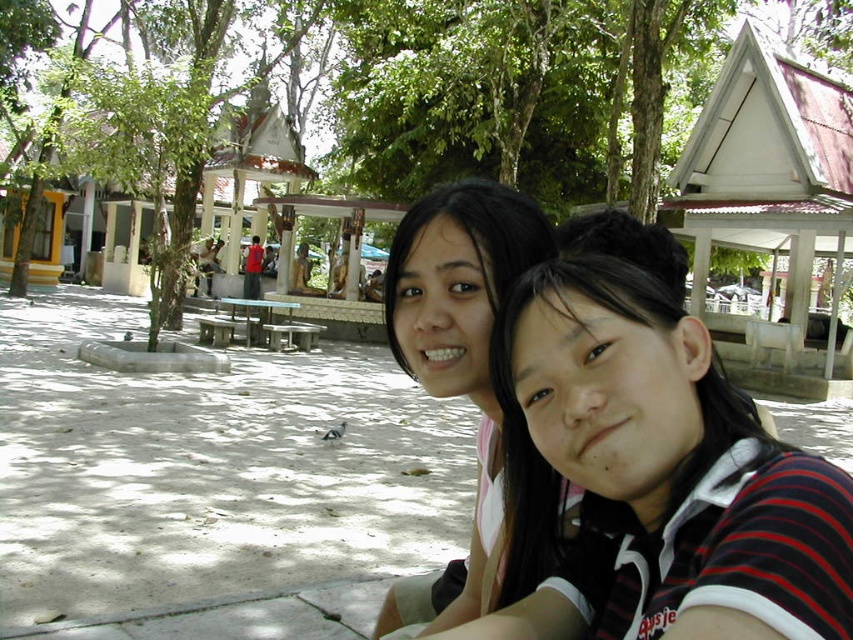
Is matte black shirt at center shorter than green leafy tree at center?

Yes.

Does matte black shirt at center have a greater height compared to green leafy tree at center?

Incorrect, matte black shirt at center's height is not larger of green leafy tree at center's.

Between point (602, 468) and point (364, 124), which one is positioned in front?

Point (602, 468) is more forward.

You are a GUI agent. You are given a task and a screenshot of the screen. Output one action in this format:
    pyautogui.click(x=<x>, y=<y>)
    Task: Click on the matte black shirt at center
    
    Given the screenshot: What is the action you would take?
    pyautogui.click(x=660, y=476)

Can you confirm if green leafy tree at center is positioned below smooth black hair at center?

Incorrect, green leafy tree at center is not positioned below smooth black hair at center.

Measure the distance from green leafy tree at center to smooth black hair at center.

green leafy tree at center and smooth black hair at center are 16.34 meters apart.

Is point (363, 115) positioned behind point (432, 292)?

Yes, point (363, 115) is behind point (432, 292).

Locate an element on the screen. The height and width of the screenshot is (640, 853). green leafy tree at center is located at coordinates (509, 88).

Can you confirm if matte black shirt at center is bigger than smooth black hair at center?

Incorrect, matte black shirt at center is not larger than smooth black hair at center.

Describe the element at coordinates (660, 476) in the screenshot. I see `matte black shirt at center` at that location.

The image size is (853, 640). Find the location of `matte black shirt at center`. matte black shirt at center is located at coordinates (660, 476).